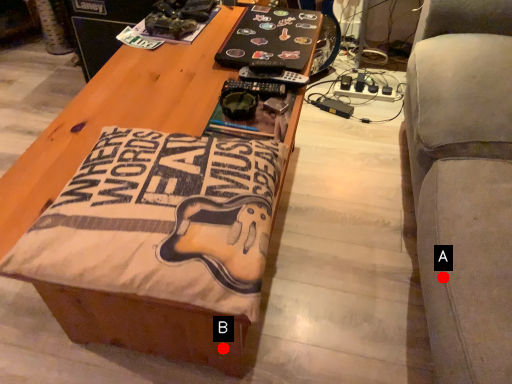
Question: Two points are circled on the image, labeled by A and B beside each circle. Among these points, which one is farthest from the camera?

Choices:
 (A) A is further
 (B) B is further

Answer: (B)